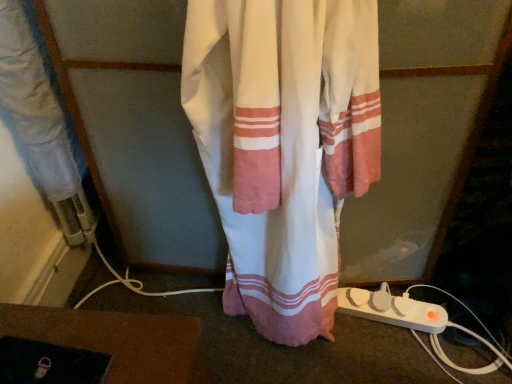
Question: From the image's perspective, is white cotton curtain at center beneath white plastic extension cord at lower right?

Choices:
 (A) no
 (B) yes

Answer: (A)

Question: Is white cotton curtain at center at the left side of white plastic extension cord at lower right?

Choices:
 (A) no
 (B) yes

Answer: (B)

Question: Is the surface of white cotton curtain at center in direct contact with white plastic extension cord at lower right?

Choices:
 (A) no
 (B) yes

Answer: (A)

Question: Considering the relative positions of white cotton curtain at center and white plastic extension cord at lower right in the image provided, is white cotton curtain at center behind white plastic extension cord at lower right?

Choices:
 (A) no
 (B) yes

Answer: (A)

Question: Is white cotton curtain at center completely or partially outside of white plastic extension cord at lower right?

Choices:
 (A) yes
 (B) no

Answer: (A)

Question: Would you consider white cotton curtain at center to be distant from white plastic extension cord at lower right?

Choices:
 (A) yes
 (B) no

Answer: (B)

Question: Can you confirm if white plastic extension cord at lower right is smaller than white cotton curtain at center?

Choices:
 (A) yes
 (B) no

Answer: (A)

Question: Can white cotton curtain at center be found inside white plastic extension cord at lower right?

Choices:
 (A) no
 (B) yes

Answer: (A)

Question: Would you consider white plastic extension cord at lower right to be distant from white cotton curtain at center?

Choices:
 (A) no
 (B) yes

Answer: (A)

Question: Can you confirm if white plastic extension cord at lower right is positioned to the left of white cotton curtain at center?

Choices:
 (A) no
 (B) yes

Answer: (A)

Question: Can you confirm if white plastic extension cord at lower right is wider than white cotton curtain at center?

Choices:
 (A) no
 (B) yes

Answer: (A)

Question: From the image's perspective, is white plastic extension cord at lower right located above white cotton curtain at center?

Choices:
 (A) yes
 (B) no

Answer: (B)

Question: Does point (374, 319) appear closer or farther from the camera than point (353, 14)?

Choices:
 (A) farther
 (B) closer

Answer: (A)